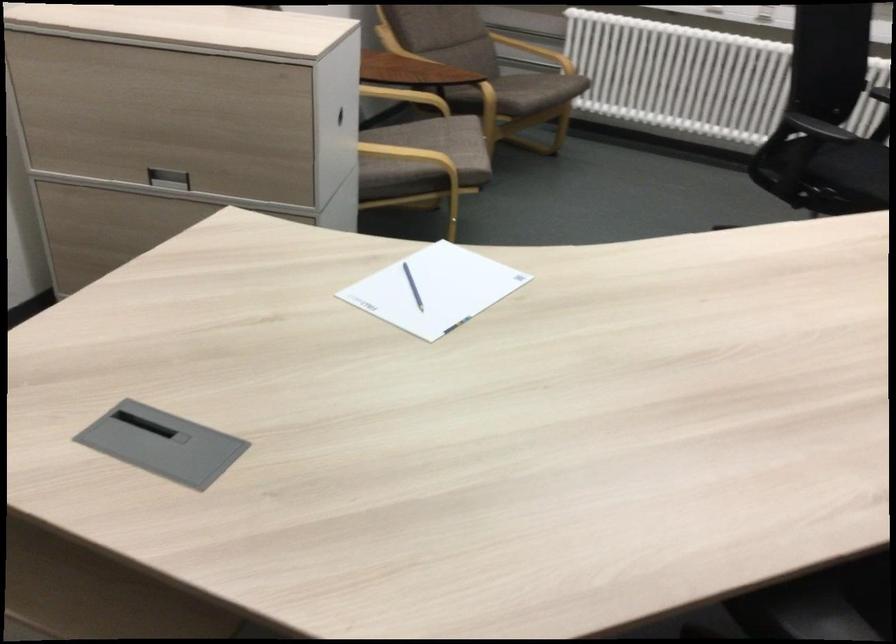
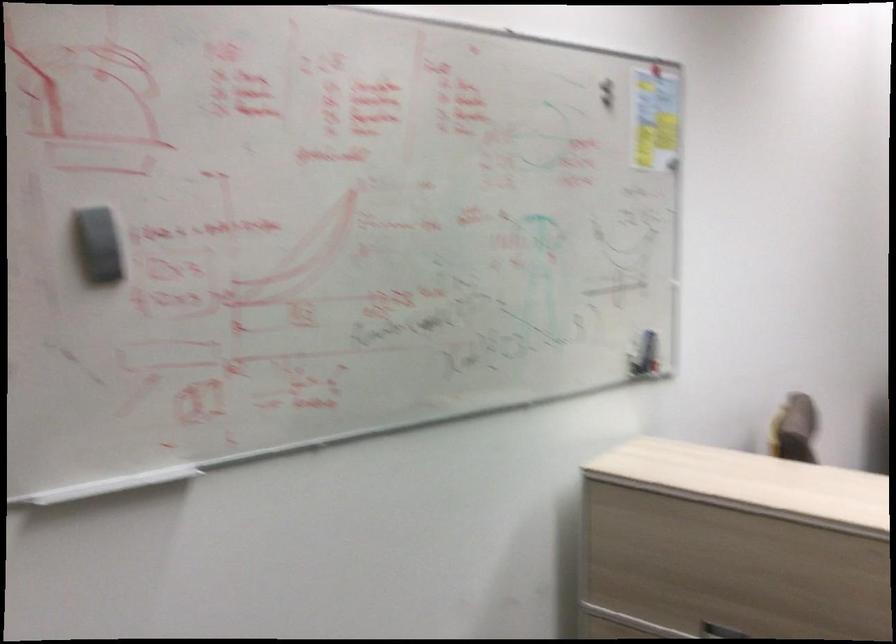
From the picture: The images are taken continuously from a first-person perspective. In which direction is your viewpoint rotating?

The rotation direction of the camera is left-up.